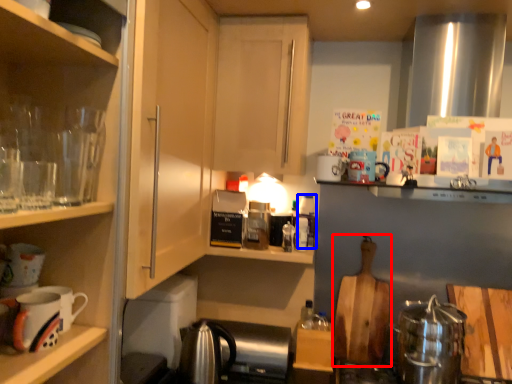
Question: Which object is further to the camera taking this photo, cutting board (highlighted by a red box) or bottle (highlighted by a blue box)?

Choices:
 (A) cutting board
 (B) bottle

Answer: (B)